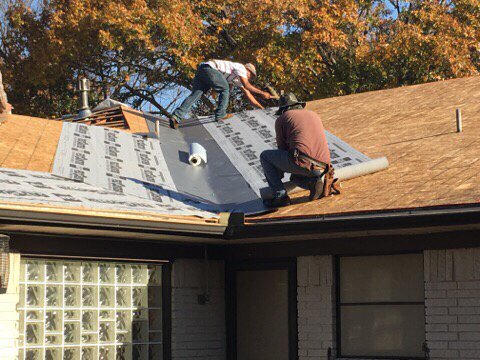
Where is `plywood on the right`? The height and width of the screenshot is (360, 480). plywood on the right is located at coordinates (413, 148).